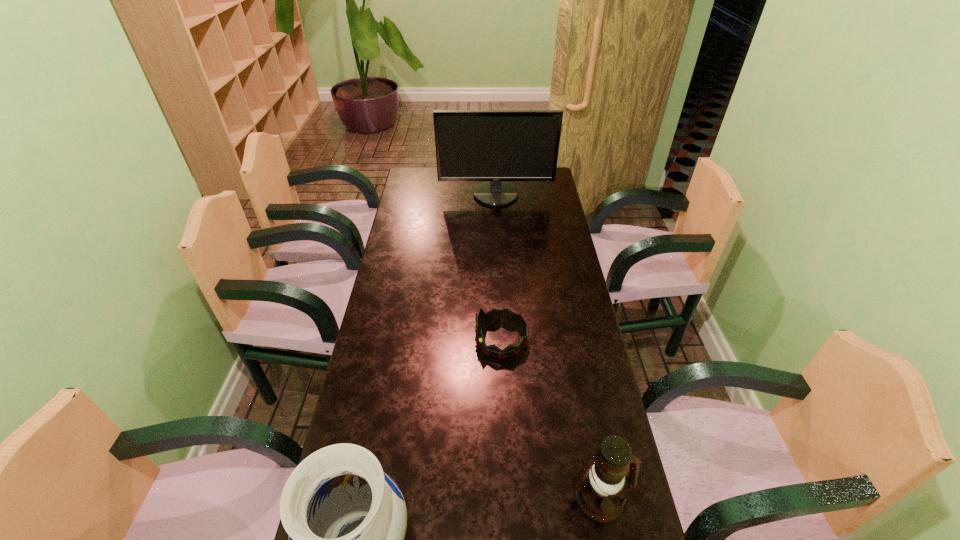
At what (x,y) coordinates should I click in order to perform the action: click on monitor that is at the right edge. Please return your answer as a coordinate pair (x, y). Image resolution: width=960 pixels, height=540 pixels. Looking at the image, I should click on (471, 145).

The width and height of the screenshot is (960, 540). In order to click on lantern at the right edge in this screenshot , I will do `click(600, 485)`.

Identify the location of object at the far right corner. (471, 145).

Where is `vacant space at the far edge`? vacant space at the far edge is located at coordinates 469,192.

You are a GUI agent. You are given a task and a screenshot of the screen. Output one action in this format:
    pyautogui.click(x=<x>, y=<y>)
    Task: Click on the vacant region at the left edge of the desktop
    This screenshot has height=540, width=960.
    Given the screenshot: What is the action you would take?
    pyautogui.click(x=412, y=245)

You are a GUI agent. You are given a task and a screenshot of the screen. Output one action in this format:
    pyautogui.click(x=<x>, y=<y>)
    Task: Click on the free space at the right edge of the desktop
    
    Given the screenshot: What is the action you would take?
    pyautogui.click(x=580, y=447)

Find the location of a particular element. This screenshot has width=960, height=540. free space at the far left corner is located at coordinates (433, 176).

The height and width of the screenshot is (540, 960). Find the location of `unoccupied area between the tiara and the farthest object`. unoccupied area between the tiara and the farthest object is located at coordinates (498, 267).

What are the coordinates of `vacant point located between the third tallest object and the second farthest object` in the screenshot? It's located at (550, 418).

This screenshot has width=960, height=540. I want to click on vacant space that's between the monitor and the shortest object, so coord(498,267).